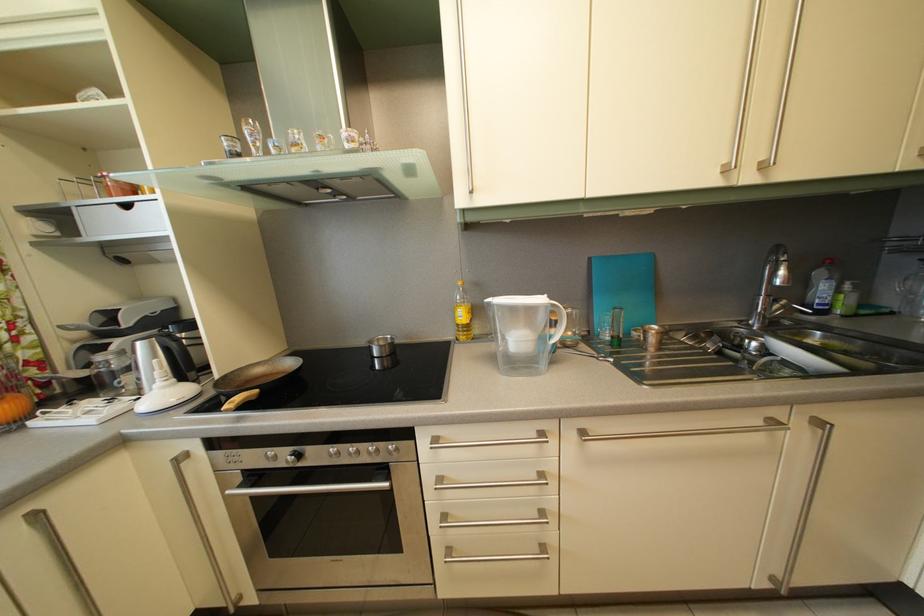
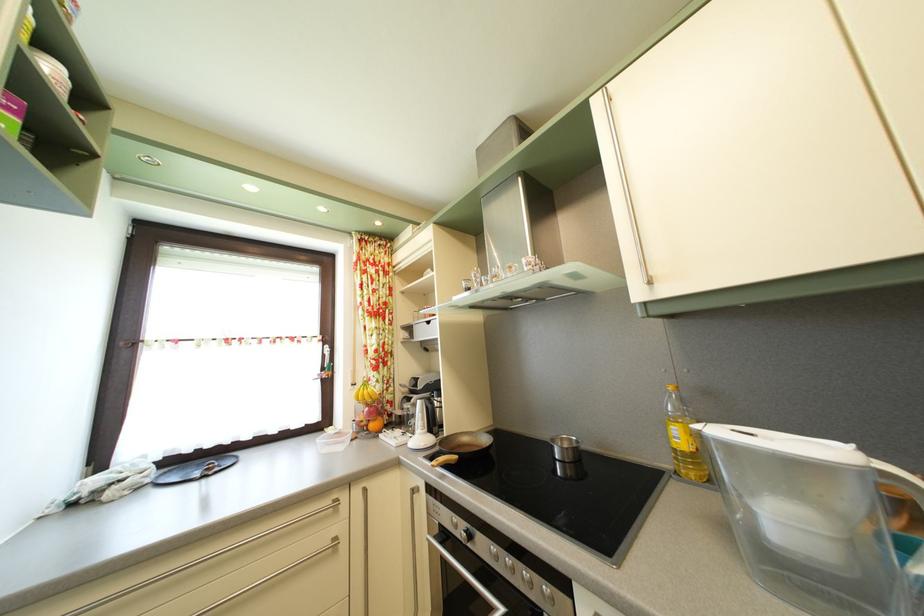
The point at [386,347] is marked in the first image. Where is the corresponding point in the second image?

(569, 448)